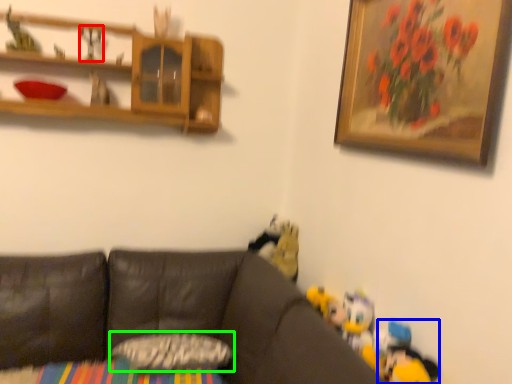
Question: Which object is positioned farthest from toy (highlighted by a red box)? Select from toy (highlighted by a blue box) and pillow (highlighted by a green box).

Choices:
 (A) toy
 (B) pillow

Answer: (A)